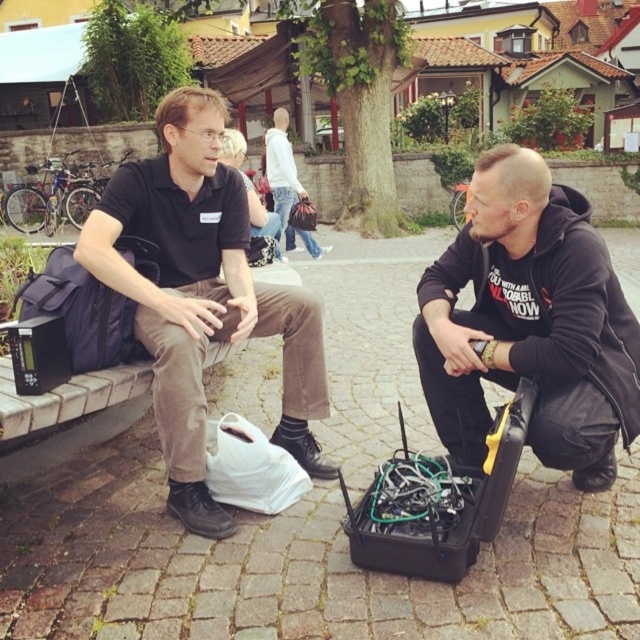
You are standing at the point labeled as point (326, 410) and want to walk towards the point labeled as point (547, 428). According to the scene, will you be moving forward or backward?

Since point (547, 428) is in front of point (326, 410), moving towards it would mean you are moving forward.

In the outdoor scene, there are two people and a point marked at coordinates (529, 323). Which object is located at that point?

The point at coordinates (529, 323) corresponds to the black hoodie at center.

You are a delivery person who needs to place a package between the black hoodie at center and the black cotton shirt at left. The package is 1.2 meters long. Can you fit it between them without moving either clothing item?

The distance between the black hoodie at center and the black cotton shirt at left is 1.15 meters. Since the package is 1.2 meters long, it cannot fit between them without moving either clothing item.